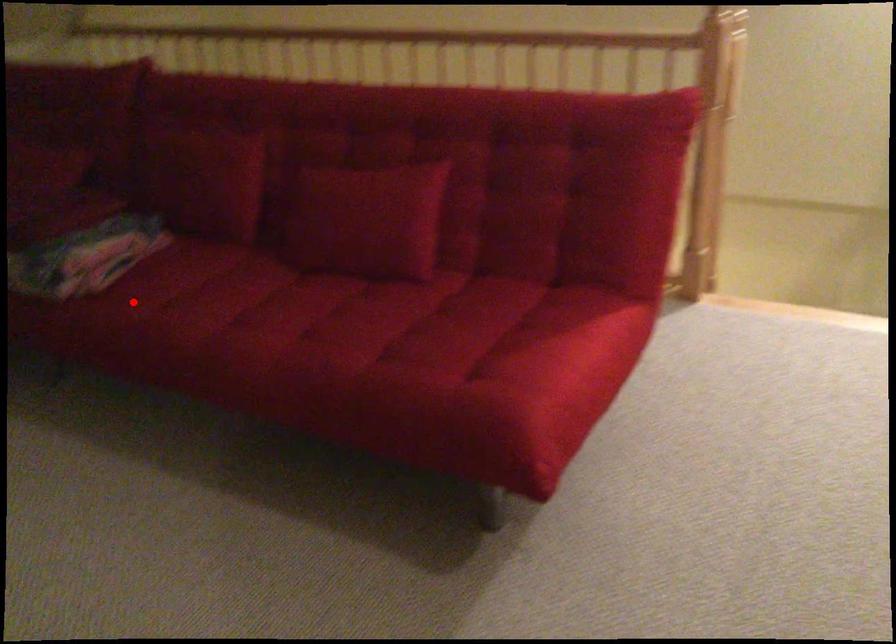
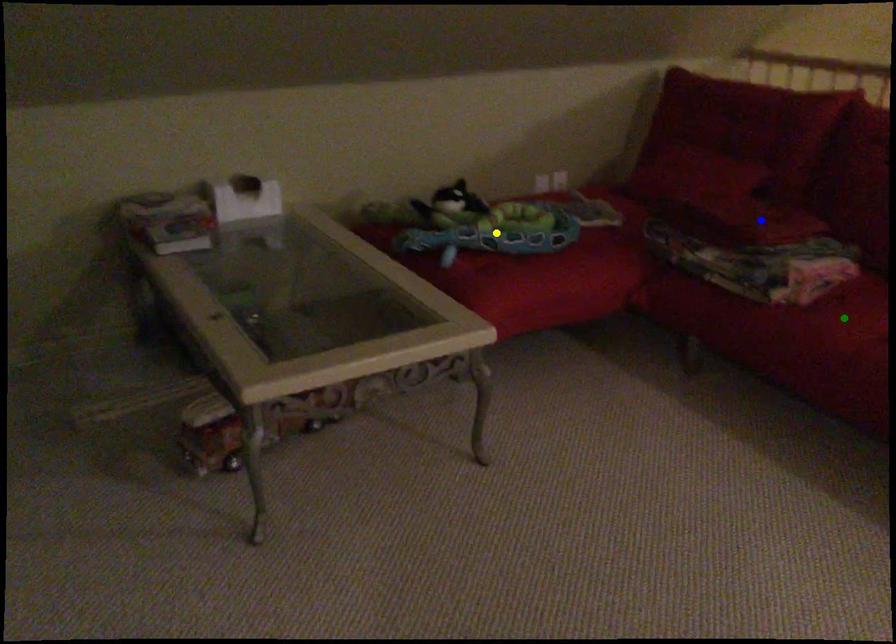
Question: I am providing you with two images of the same scene from different viewpoints. A red point is marked on the first image. You are given multiple points on the second image. Which point in image 2 is actually the same real-world point as the red point in image 1?

Choices:
 (A) green point
 (B) yellow point
 (C) blue point

Answer: (A)